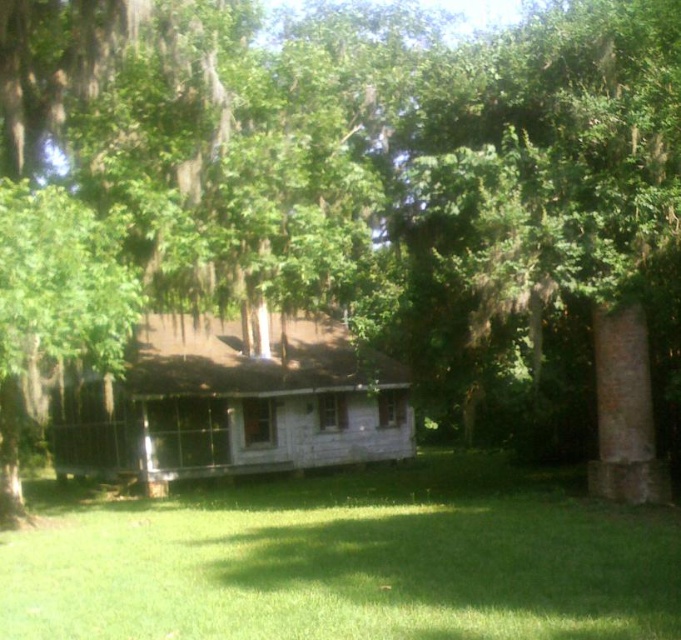
Between green mossy tree at center and weathered wood porch at center, which one appears on the left side from the viewer's perspective?

From the viewer's perspective, weathered wood porch at center appears more on the left side.

Can you confirm if green mossy tree at center is bigger than weathered wood porch at center?

No, green mossy tree at center is not bigger than weathered wood porch at center.

What do you see at coordinates (575, 195) in the screenshot?
I see `green mossy tree at center` at bounding box center [575, 195].

You are a GUI agent. You are given a task and a screenshot of the screen. Output one action in this format:
    pyautogui.click(x=<x>, y=<y>)
    Task: Click on the green mossy tree at center
    
    Given the screenshot: What is the action you would take?
    pyautogui.click(x=575, y=195)

Who is shorter, green grass at lower center or green mossy tree at center?

green mossy tree at center is shorter.

Who is taller, green grass at lower center or green mossy tree at center?

green grass at lower center

Who is more distant from viewer, (390, 611) or (635, 468)?

The point (635, 468) is more distant.

You are a GUI agent. You are given a task and a screenshot of the screen. Output one action in this format:
    pyautogui.click(x=<x>, y=<y>)
    Task: Click on the green grass at lower center
    
    Given the screenshot: What is the action you would take?
    pyautogui.click(x=349, y=561)

Is point (27, 536) farther from viewer compared to point (84, 448)?

That is False.

Can you confirm if green grass at lower center is taller than weathered wood porch at center?

Incorrect, green grass at lower center's height is not larger of weathered wood porch at center's.

This screenshot has height=640, width=681. What are the coordinates of `green grass at lower center` in the screenshot? It's located at (349, 561).

Locate an element on the screen. Image resolution: width=681 pixels, height=640 pixels. green grass at lower center is located at coordinates (349, 561).